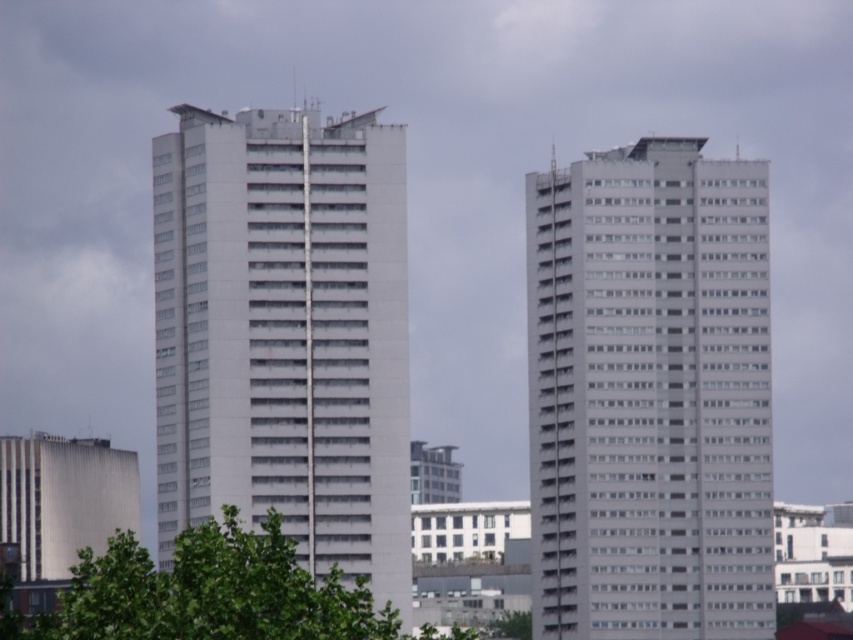
You are standing in front of the two identical highrise buildings. You notice two points marked on the image at coordinates point (589, 518) and point (401, 460). Which point is closer to you?

Point (401, 460) is closer to you because point (589, 518) is behind it.

You are a city planner reviewing the urban layout. You notice the white smooth building at right and the green leafy tree at center. Based on their heights, which one would require more consideration for wind resistance in high winds?

The white smooth building at right requires more consideration for wind resistance in high winds because it has a greater height compared to the green leafy tree at center, making it more susceptible to wind forces.

You are a city planner reviewing the urban layout. You notice the white smooth building at right and the green leafy tree at center. Which object is located higher in the image?

The white smooth building at right is positioned over the green leafy tree at center, meaning it is higher in the image.